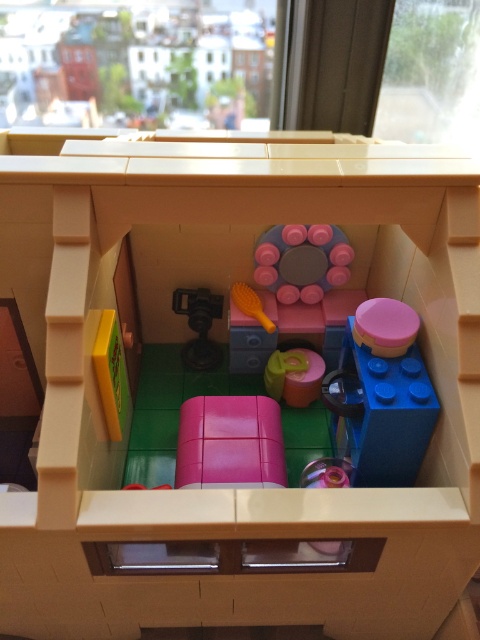
Is matte black camera at center to the left of yellow plastic brush at center from the viewer's perspective?

Yes, matte black camera at center is to the left of yellow plastic brush at center.

Who is positioned more to the right, matte black camera at center or yellow plastic brush at center?

yellow plastic brush at center

Which is behind, point (199, 349) or point (240, 305)?

The point (199, 349) is behind.

In order to click on matte black camera at center in this screenshot , I will do `click(199, 326)`.

This screenshot has width=480, height=640. What do you see at coordinates (294, 376) in the screenshot?
I see `matte pink cupcake at center` at bounding box center [294, 376].

Consider the image. Measure the distance between matte pink cupcake at center and camera.

matte pink cupcake at center is 1.13 meters away from camera.

You are a GUI agent. You are given a task and a screenshot of the screen. Output one action in this format:
    pyautogui.click(x=<x>, y=<y>)
    Task: Click on the matte pink cupcake at center
    This screenshot has height=640, width=480.
    Given the screenshot: What is the action you would take?
    pyautogui.click(x=294, y=376)

The image size is (480, 640). What do you see at coordinates (382, 396) in the screenshot?
I see `blue plastic cup at center right` at bounding box center [382, 396].

Is blue plastic cup at center right wider than yellow plastic brush at center?

Yes.

Is point (386, 365) behind point (253, 301)?

No, it is not.

At what (x,y) coordinates should I click in order to perform the action: click on blue plastic cup at center right. Please return your answer as a coordinate pair (x, y). The width and height of the screenshot is (480, 640). Looking at the image, I should click on (382, 396).